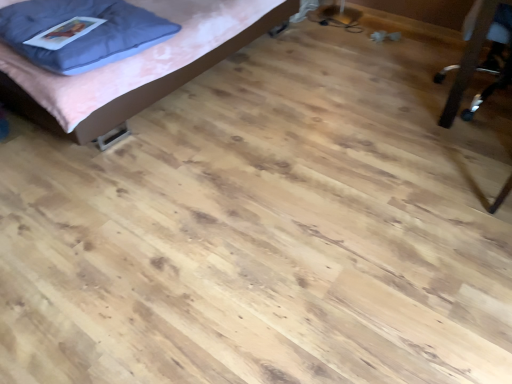
You are a GUI agent. You are given a task and a screenshot of the screen. Output one action in this format:
    pyautogui.click(x=<x>, y=<y>)
    Task: Click on the vacant space behind metallic silver chair at right
    This screenshot has height=384, width=512.
    Given the screenshot: What is the action you would take?
    pyautogui.click(x=415, y=49)